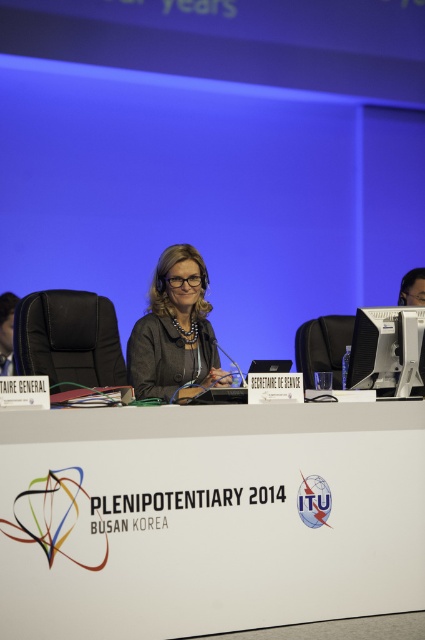
Which is more to the right, matte black jacket at center or sleek black monitor at center?

sleek black monitor at center is more to the right.

Can you confirm if matte black jacket at center is bigger than sleek black monitor at center?

Correct, matte black jacket at center is larger in size than sleek black monitor at center.

At what (x,y) coordinates should I click in order to perform the action: click on matte black jacket at center. Please return your answer as a coordinate pair (x, y). Looking at the image, I should click on (173, 330).

Who is lower down, white plastic table at center or sleek black monitor at center?

white plastic table at center is below.

Can you confirm if white plastic table at center is smaller than sleek black monitor at center?

Incorrect, white plastic table at center is not smaller in size than sleek black monitor at center.

Is point (343, 474) farther from camera compared to point (399, 360)?

No, it is not.

Identify the location of white plastic table at center. The height and width of the screenshot is (640, 425). (209, 516).

Is white plastic table at center positioned in front of matte black jacket at center?

Yes.

Measure the distance between white plastic table at center and camera.

2.36 meters

Where is `white plastic table at center`? white plastic table at center is located at coordinates (209, 516).